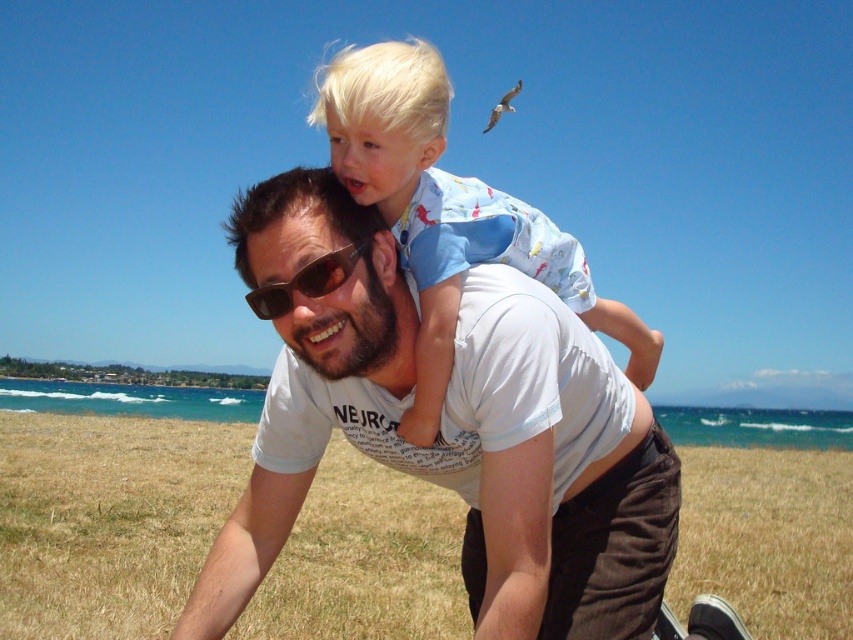
What is the exact coordinate of the white cotton shirt at center?

The white cotton shirt at center is located at point [448,428].

You are a photographer trying to capture a photo of the two people in the scene. You notice both the white cotton shirt at center and the light blue cotton shirt at center. Which shirt is positioned lower in the image?

The white cotton shirt at center is positioned lower in the image as it is described to be below the light blue cotton shirt at center.

You are a photographer trying to capture both the white cotton shirt at center and the light blue cotton shirt at center in a single frame. Which shirt should you adjust your camera angle to focus on first if you want to ensure both are fully visible?

The white cotton shirt at center has a lesser width compared to light blue cotton shirt at center, so you should focus on the light blue cotton shirt at center first to ensure it fits within the frame.